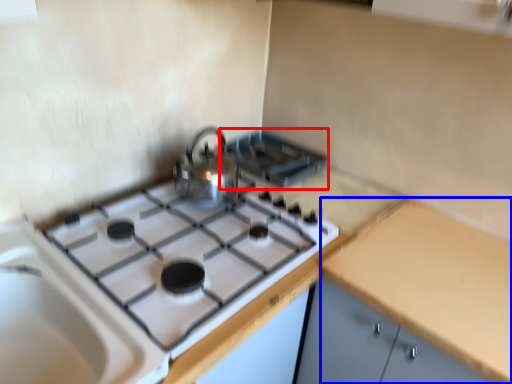
Question: Which point is closer to the camera, appliance (highlighted by a red box) or counter top (highlighted by a blue box)?

Choices:
 (A) appliance
 (B) counter top

Answer: (B)